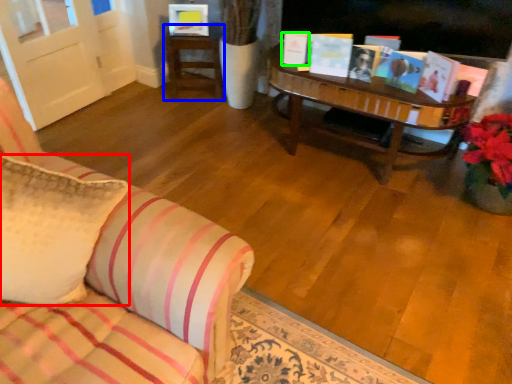
Question: Based on their relative distances, which object is nearer to pillow (highlighted by a red box)? Choose from table (highlighted by a blue box) and book (highlighted by a green box).

Choices:
 (A) table
 (B) book

Answer: (B)